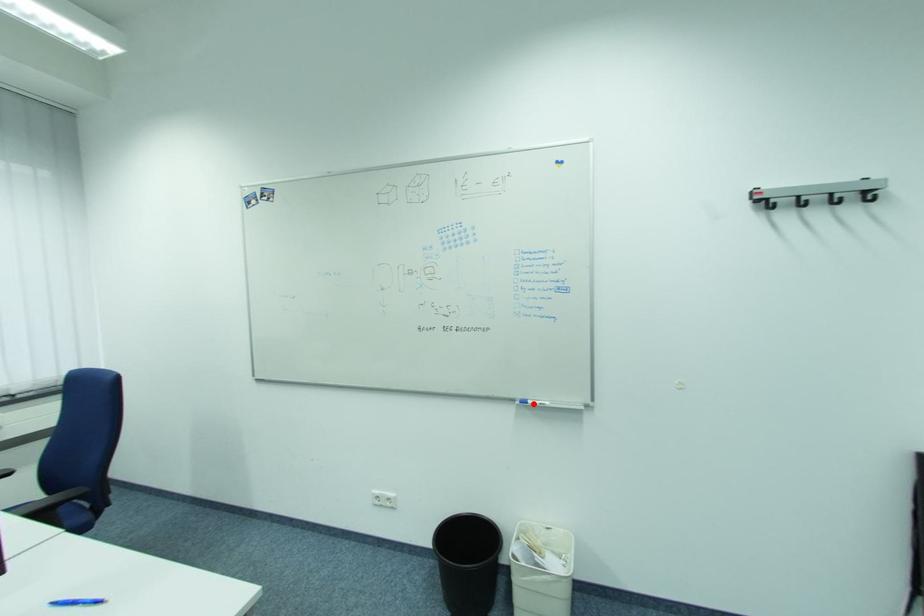
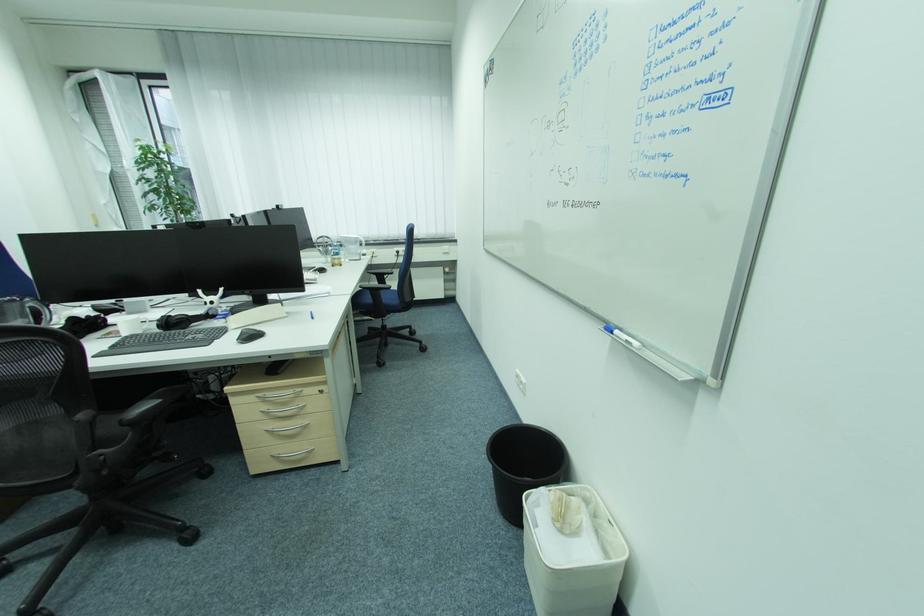
Where in the second image is the point corresponding to the highlighted location from the first image?

(618, 334)